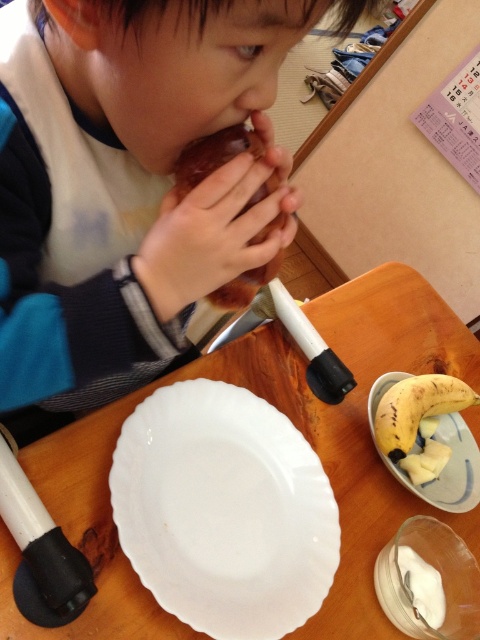
Question: Is matte brown donut at upper left to the left of wooden table at center from the viewer's perspective?

Choices:
 (A) no
 (B) yes

Answer: (B)

Question: Considering the real-world distances, which object is closest to the chocolate cake at center?

Choices:
 (A) yellow matte platter at lower right
 (B) wooden table at center
 (C) white glossy platter at lower center
 (D) matte brown donut at upper left

Answer: (D)

Question: Is matte brown donut at upper left to the right of white glossy platter at lower center from the viewer's perspective?

Choices:
 (A) no
 (B) yes

Answer: (A)

Question: Does wooden table at center appear on the right side of yellow matte platter at lower right?

Choices:
 (A) no
 (B) yes

Answer: (A)

Question: Which of the following is the farthest from the observer?

Choices:
 (A) (445, 422)
 (B) (260, 454)

Answer: (A)

Question: Among these points, which one is nearest to the camera?

Choices:
 (A) click(x=256, y=177)
 (B) click(x=269, y=342)
 (C) click(x=134, y=504)
 (D) click(x=206, y=170)

Answer: (A)